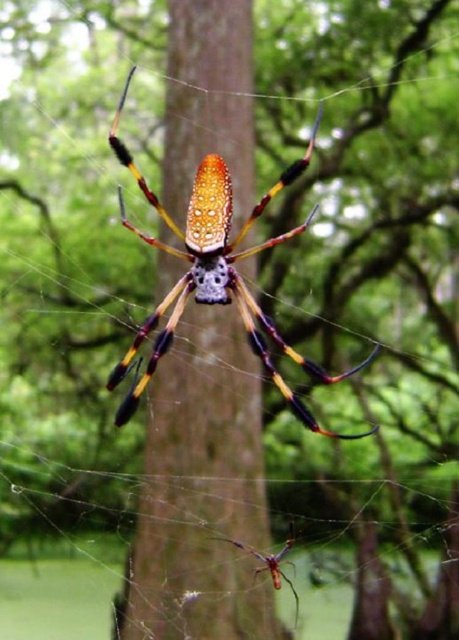
You are an entomologist examining a spider web. You notice the brown wood tree trunk at center and the shiny metallic spider at center. Which object is larger in size?

The shiny metallic spider at center is larger than the brown wood tree trunk at center.